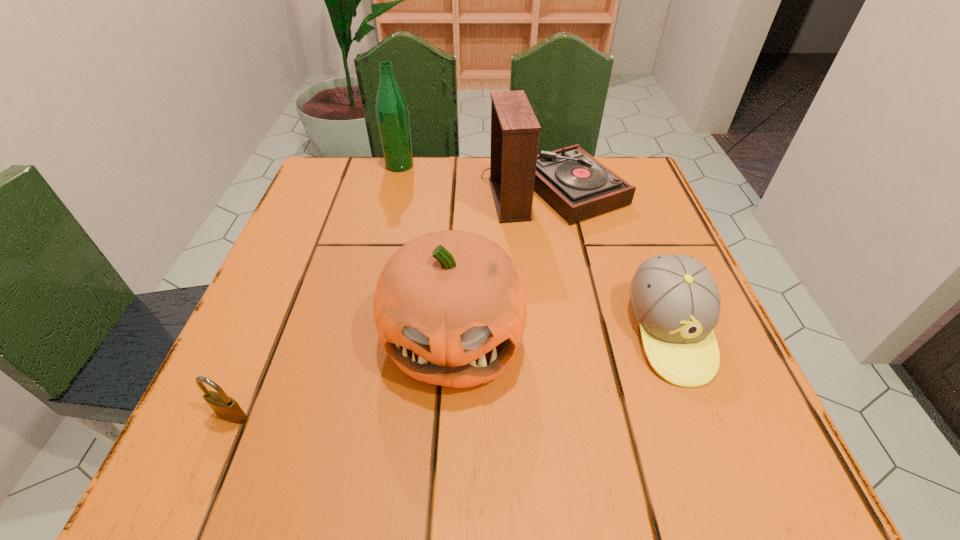
The image size is (960, 540). Find the location of `object present at the far right corner`. object present at the far right corner is located at coordinates (578, 186).

Locate an element on the screen. free space at the far edge is located at coordinates (413, 203).

Find the location of `vacant region at the near edge of the desktop`. vacant region at the near edge of the desktop is located at coordinates (449, 457).

This screenshot has height=540, width=960. I want to click on free space at the left edge of the desktop, so click(x=261, y=389).

In the image, there is a desktop. Where is `vacant space at the right edge`? The image size is (960, 540). vacant space at the right edge is located at coordinates (692, 411).

Where is `empty space that is in between the fourth object from right to left and the baseball cap`? The width and height of the screenshot is (960, 540). empty space that is in between the fourth object from right to left and the baseball cap is located at coordinates (535, 249).

Image resolution: width=960 pixels, height=540 pixels. Identify the location of vacant space in between the shortest object and the bottle. (316, 291).

Locate an element on the screen. free spot between the pumpkin and the leftmost object is located at coordinates (343, 376).

The height and width of the screenshot is (540, 960). I want to click on free space between the phonograph record and the bottle, so (x=476, y=178).

Select which object is the fourth closest to the baseball cap. Please provide its 2D coordinates. Your answer should be formatted as a tuple, i.e. [(x, y)], where the tuple contains the x and y coordinates of a point satisfying the conditions above.

[(227, 408)]